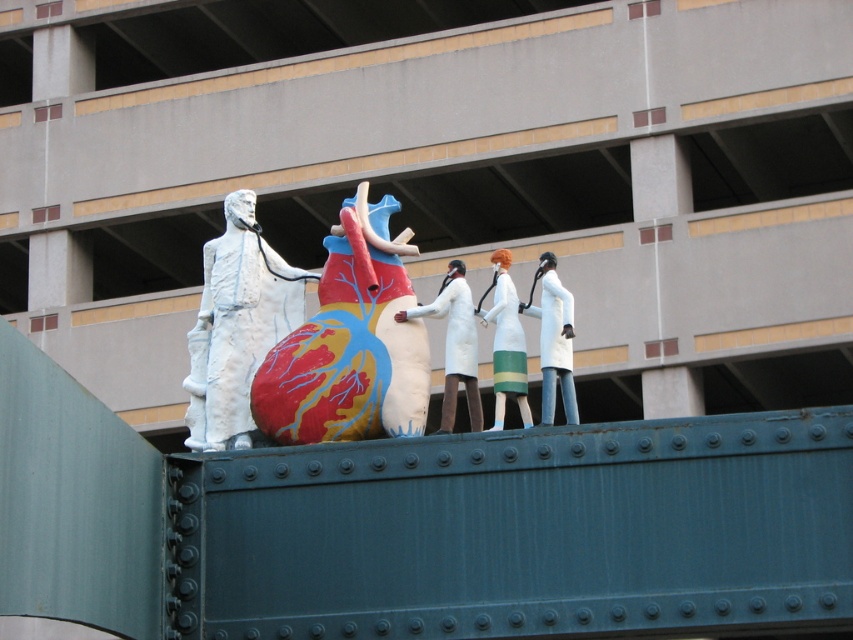
You are standing at the center of the sculpture and looking towards the point marked as point (x=349, y=342). What object is located exactly at that point?

The polychrome painted heart at center is located exactly at point (x=349, y=342).

You are standing at the camera position and want to take a photo of the polychrome painted heart at center. If your camera has a maximum focus range of 35 meters, will you be able to capture it clearly?

The polychrome painted heart at center is 38.23 meters away from camera, which exceeds the camera maximum focus range of 35 meters. Therefore, you cannot capture it clearly.

You are an art student analyzing the sculpture. You notice the polychrome painted heart at center and the white matte dress at center. Which object is bigger in size?

The polychrome painted heart at center is larger in size compared to the white matte dress at center.